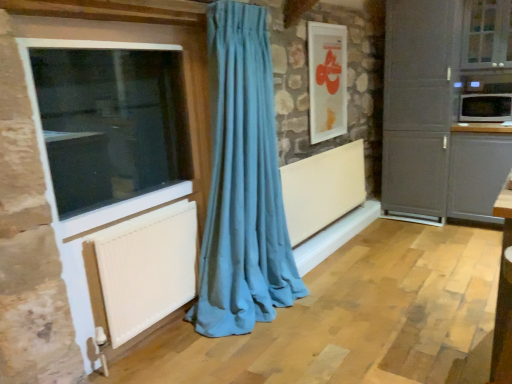
Measure the distance between white glossy microwave at upper right and camera.

12.09 feet.

Measure the distance between point (478, 92) and camera.

The distance of point (478, 92) from camera is 3.78 meters.

The height and width of the screenshot is (384, 512). Describe the element at coordinates (444, 107) in the screenshot. I see `matte gray cabinet at right, acting as the 1th cabinetry starting from the left` at that location.

In order to face white matte radiator at center, placed as the first radiator when sorted from right to left, should I rotate leftwards or rightwards?

Turn right approximately 9.569 degrees to face it.

The height and width of the screenshot is (384, 512). I want to click on white matte radiator at center, which ranks as the 1th radiator in back-to-front order, so click(x=322, y=189).

What is the approximate width of white glossy picture frame at upper center?

white glossy picture frame at upper center is 2.36 inches in width.

Where is `teal fabric curtain at center`? teal fabric curtain at center is located at coordinates (243, 183).

The image size is (512, 384). Find the location of `white glossy microwave at upper right`. white glossy microwave at upper right is located at coordinates (486, 98).

Identify the location of the 2nd cabinetry behind the white textured radiator at lower left, marked as the second radiator in a back-to-front arrangement, counting from the anchor's position. The width and height of the screenshot is (512, 384). (477, 169).

How much distance is there between white textured radiator at lower left, marked as the second radiator in a right-to-left arrangement, and matte gray cabinet at right, which appears as the 1th cabinetry when viewed from the right?

They are 8.95 feet apart.

Which point is more distant from viewer, (114, 236) or (469, 132)?

Positioned behind is point (469, 132).

Which object is closer to the camera, white textured radiator at lower left, marked as the second radiator in a back-to-front arrangement, or matte gray cabinet at right, which is the 2th cabinetry from left to right?

white textured radiator at lower left, marked as the second radiator in a back-to-front arrangement.

You are a GUI agent. You are given a task and a screenshot of the screen. Output one action in this format:
    pyautogui.click(x=<x>, y=<y>)
    Task: Click on the curtain that is on the left side of matte gray cabinet at right, arranged as the 2th cabinetry when viewed from the right
    This screenshot has height=384, width=512.
    Given the screenshot: What is the action you would take?
    pyautogui.click(x=243, y=183)

How different are the orientations of teal fabric curtain at center and matte gray cabinet at right, arranged as the 2th cabinetry when viewed from the right, in degrees?

teal fabric curtain at center and matte gray cabinet at right, arranged as the 2th cabinetry when viewed from the right, are facing 89.8 degrees away from each other.

Between teal fabric curtain at center and matte gray cabinet at right, arranged as the 2th cabinetry when viewed from the right, which one is positioned behind?

matte gray cabinet at right, arranged as the 2th cabinetry when viewed from the right, is more distant.

Is teal fabric curtain at center to the left of matte gray cabinet at right, acting as the 1th cabinetry starting from the left, from the viewer's perspective?

Yes.

Is teal fabric curtain at center located within white textured radiator at lower left, which is the first radiator from front to back?

No, white textured radiator at lower left, which is the first radiator from front to back, does not contain teal fabric curtain at center.

This screenshot has width=512, height=384. Identify the location of radiator on the left of teal fabric curtain at center. (145, 268).

Is white textured radiator at lower left, which is the first radiator from front to back, to the left or to the right of teal fabric curtain at center in the image?

Clearly, white textured radiator at lower left, which is the first radiator from front to back, is on the left of teal fabric curtain at center in the image.

Considering the relative sizes of matte gray cabinet at right, arranged as the 2th cabinetry when viewed from the right, and white plastic window at left, which appears as the 2th window when viewed from the back, in the image provided, is matte gray cabinet at right, arranged as the 2th cabinetry when viewed from the right, smaller than white plastic window at left, which appears as the 2th window when viewed from the back,?

Incorrect, matte gray cabinet at right, arranged as the 2th cabinetry when viewed from the right, is not smaller in size than white plastic window at left, which appears as the 2th window when viewed from the back.

Is point (386, 155) closer or farther from the camera than point (200, 175)?

Point (386, 155) is positioned farther from the camera compared to point (200, 175).

Starting from the white glossy picture frame at upper center, which radiator is the 1st one to the left? Please provide its 2D coordinates.

[(322, 189)]

Considering the points (346, 32) and (305, 217), which point is behind, point (346, 32) or point (305, 217)?

The point (346, 32) is farther.

Does white glossy picture frame at upper center have a greater height compared to white matte radiator at center, which ranks as the 1th radiator in back-to-front order?

Indeed, white glossy picture frame at upper center has a greater height compared to white matte radiator at center, which ranks as the 1th radiator in back-to-front order.

Based on the photo, which of these two, white glossy picture frame at upper center or white matte radiator at center, which ranks as the 1th radiator in back-to-front order, is thinner?

white glossy picture frame at upper center is thinner.

Which object is thinner, matte gray cabinet at right, arranged as the 2th cabinetry when viewed from the right, or matte gray cabinet at right, which appears as the 1th cabinetry when viewed from the right?

matte gray cabinet at right, which appears as the 1th cabinetry when viewed from the right.

Is matte gray cabinet at right, arranged as the 2th cabinetry when viewed from the right, aimed at matte gray cabinet at right, which appears as the 1th cabinetry when viewed from the right?

No, matte gray cabinet at right, arranged as the 2th cabinetry when viewed from the right, does not turn towards matte gray cabinet at right, which appears as the 1th cabinetry when viewed from the right.

Where is `cabinetry above the matte gray cabinet at right, which is the 2th cabinetry from left to right (from the image's perspective)`? The width and height of the screenshot is (512, 384). cabinetry above the matte gray cabinet at right, which is the 2th cabinetry from left to right (from the image's perspective) is located at coordinates pyautogui.click(x=444, y=107).

Are matte gray cabinet at right, acting as the 1th cabinetry starting from the left, and matte gray cabinet at right, which appears as the 1th cabinetry when viewed from the right, located far from each other?

Actually, matte gray cabinet at right, acting as the 1th cabinetry starting from the left, and matte gray cabinet at right, which appears as the 1th cabinetry when viewed from the right, are a little close together.

Is point (461, 119) positioned behind point (490, 16)?

That is True.

Looking at this image, from a real-world perspective, is white glossy microwave at upper right under clear glass window at upper right, acting as the 1th window starting from the top?

Yes, from a real-world perspective, white glossy microwave at upper right is below clear glass window at upper right, acting as the 1th window starting from the top.

Does white glossy microwave at upper right lie in front of clear glass window at upper right, which appears as the second window when viewed from the left?

No, white glossy microwave at upper right is behind clear glass window at upper right, which appears as the second window when viewed from the left.

Based on the photo, would you say white glossy microwave at upper right contains clear glass window at upper right, which appears as the second window when viewed from the left?

No, clear glass window at upper right, which appears as the second window when viewed from the left, is not inside white glossy microwave at upper right.

There is a matte gray cabinet at right, which appears as the 1th cabinetry when viewed from the right. Identify the location of the 2nd radiator below it (from the image's perspective). (145, 268).

You are a GUI agent. You are given a task and a screenshot of the screen. Output one action in this format:
    pyautogui.click(x=<x>, y=<y>)
    Task: Click on the 2nd cabinetry above the teal fabric curtain at center (from the image's perspective)
    
    Given the screenshot: What is the action you would take?
    pyautogui.click(x=444, y=107)

Based on their spatial positions, is matte gray cabinet at right, acting as the 1th cabinetry starting from the left, or white glossy microwave at upper right further from white plastic window at left, positioned as the 1th window in left-to-right order?

The object further to white plastic window at left, positioned as the 1th window in left-to-right order, is white glossy microwave at upper right.

Looking at the image, which one is located closer to white plastic window at left, which appears as the 2th window when viewed from the right, matte gray cabinet at right, arranged as the 2th cabinetry when viewed from the right, or teal fabric curtain at center?

The object closer to white plastic window at left, which appears as the 2th window when viewed from the right, is teal fabric curtain at center.

From the image, which object appears to be nearer to matte gray cabinet at right, acting as the 1th cabinetry starting from the left, white textured radiator at lower left, marked as the second radiator in a back-to-front arrangement, or teal fabric curtain at center?

teal fabric curtain at center is closer to matte gray cabinet at right, acting as the 1th cabinetry starting from the left.

Estimate the real-world distances between objects in this image. Which object is closer to white textured radiator at lower left, marked as the second radiator in a right-to-left arrangement, white glossy microwave at upper right or matte gray cabinet at right, which appears as the 1th cabinetry when viewed from the right?

matte gray cabinet at right, which appears as the 1th cabinetry when viewed from the right.

Looking at the image, which one is located further to matte gray cabinet at right, arranged as the 2th cabinetry when viewed from the right, white matte radiator at center, placed as the 2th radiator when sorted from left to right, or white textured radiator at lower left, which is the first radiator from front to back?

Among the two, white textured radiator at lower left, which is the first radiator from front to back, is located further to matte gray cabinet at right, arranged as the 2th cabinetry when viewed from the right.

Looking at the image, which one is located further to white glossy picture frame at upper center, matte gray cabinet at right, which is the 2th cabinetry from left to right, or white matte radiator at center, which ranks as the 1th radiator in back-to-front order?

matte gray cabinet at right, which is the 2th cabinetry from left to right.

When comparing their distances from white glossy microwave at upper right, does clear glass window at upper right, which appears as the 1th window when viewed from the back, or matte gray cabinet at right, arranged as the 2th cabinetry when viewed from the right, seem further?

Among the two, matte gray cabinet at right, arranged as the 2th cabinetry when viewed from the right, is located further to white glossy microwave at upper right.

Looking at the image, which one is located further to white matte radiator at center, marked as the second radiator in a front-to-back arrangement, white plastic window at left, which appears as the 2th window when viewed from the back, or teal fabric curtain at center?

Based on the image, white plastic window at left, which appears as the 2th window when viewed from the back, appears to be further to white matte radiator at center, marked as the second radiator in a front-to-back arrangement.

Where is `curtain between white textured radiator at lower left, marked as the second radiator in a right-to-left arrangement, and white glossy microwave at upper right, in the horizontal direction`? curtain between white textured radiator at lower left, marked as the second radiator in a right-to-left arrangement, and white glossy microwave at upper right, in the horizontal direction is located at coordinates (243, 183).

Locate an element on the screen. picture frame located between white textured radiator at lower left, marked as the second radiator in a right-to-left arrangement, and white glossy microwave at upper right in the left-right direction is located at coordinates (327, 80).

The width and height of the screenshot is (512, 384). What are the coordinates of `picture frame between white plastic window at left, the 1th window from the front, and matte gray cabinet at right, which is the 2th cabinetry from left to right, in the horizontal direction` in the screenshot? It's located at (327, 80).

Identify the location of picture frame situated between teal fabric curtain at center and clear glass window at upper right, acting as the 1th window starting from the top, from left to right. (327, 80).